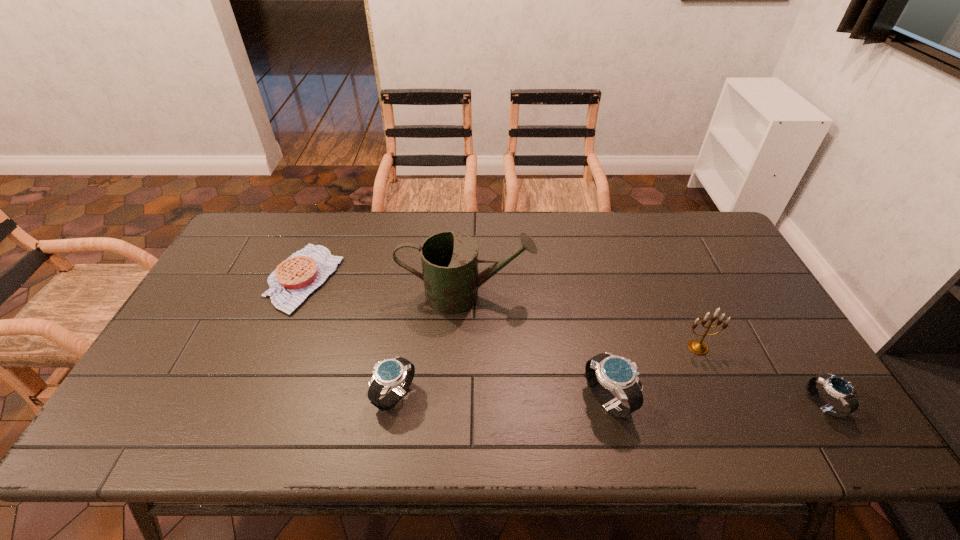
Locate an element on the screen. The height and width of the screenshot is (540, 960). the shortest object is located at coordinates (292, 281).

At what (x,y) coordinates should I click in order to perform the action: click on free region located 0.210m on the right of the second shortest watch. Please return your answer as a coordinate pair (x, y). The width and height of the screenshot is (960, 540). Looking at the image, I should click on (502, 396).

Find the location of `free spot located on the right of the tallest watch`. free spot located on the right of the tallest watch is located at coordinates pyautogui.click(x=667, y=400).

Locate an element on the screen. blank area located on the left of the fifth tallest object is located at coordinates (699, 405).

Locate an element on the screen. The width and height of the screenshot is (960, 540). free space located on the right of the fourth nearest object is located at coordinates (794, 348).

Locate an element on the screen. The image size is (960, 540). free space located 0.370m with the spout on the tallest object is located at coordinates click(658, 294).

The image size is (960, 540). In order to click on vacant space located on the right of the leftmost object in this screenshot , I will do `click(416, 278)`.

Identify the location of object that is at the far edge. (292, 281).

Where is `object that is positioned at the right edge`? The image size is (960, 540). object that is positioned at the right edge is located at coordinates (838, 387).

Where is `object at the near right corner`? object at the near right corner is located at coordinates (838, 387).